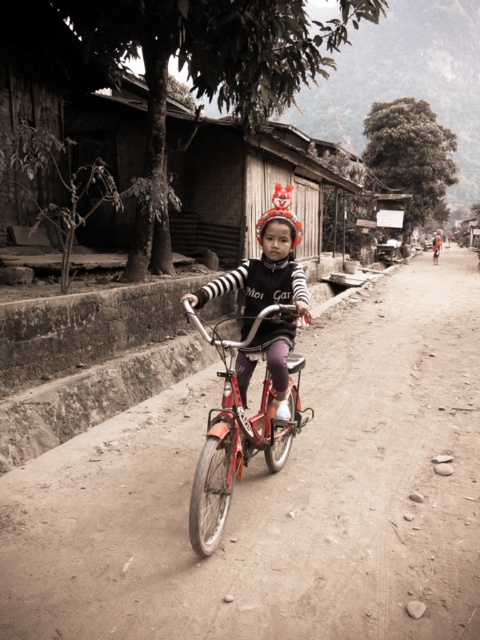
Question: Which point is farther to the camera?

Choices:
 (A) metallic red bicycle at center
 (B) matte black shirt at center

Answer: (B)

Question: Which is farther from the matte black shirt at center?

Choices:
 (A) dirt track at center
 (B) metallic red bicycle at center

Answer: (A)

Question: Which point is closer to the camera?

Choices:
 (A) metallic red bicycle at center
 (B) dirt track at center

Answer: (B)

Question: Is metallic red bicycle at center bigger than matte black shirt at center?

Choices:
 (A) no
 (B) yes

Answer: (B)

Question: Observing the image, what is the correct spatial positioning of metallic red bicycle at center in reference to matte black shirt at center?

Choices:
 (A) right
 (B) left

Answer: (A)

Question: Where is dirt track at center located in relation to matte black shirt at center in the image?

Choices:
 (A) left
 (B) right

Answer: (B)